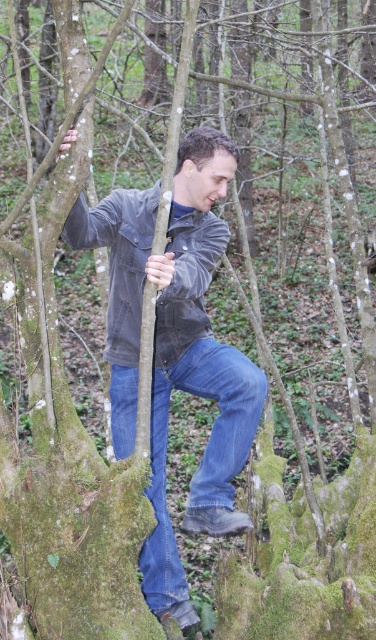
Please look at the coordinates provided in the image. What object is located at the point with coordinates (203, 454)?

The point at coordinates (203, 454) corresponds to the blue denim jeans at center.

You are a hiker who just arrived at the forest trail. You see the blue denim jeans at center and the washed denim jacket at center. Which piece of clothing is positioned to the right?

The blue denim jeans at center are to the right of the washed denim jacket at center.